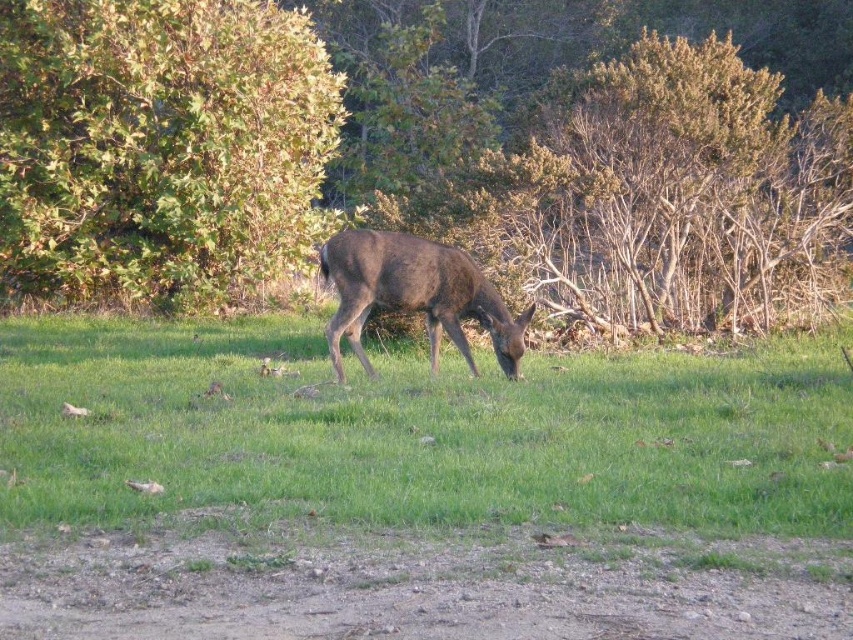
Measure the distance from green leafy tree at upper left to green leafy bush at upper left.

A distance of 3.70 feet exists between green leafy tree at upper left and green leafy bush at upper left.

Who is lower down, green leafy tree at upper left or green leafy bush at upper left?

Positioned lower is green leafy bush at upper left.

The image size is (853, 640). What are the coordinates of `green leafy tree at upper left` in the screenshot? It's located at (428, 150).

Between green grassy at center and brown matte deer at center, which one is positioned higher?

brown matte deer at center

Between green grassy at center and brown matte deer at center, which one has more height?

brown matte deer at center is taller.

Which is behind, point (467, 512) or point (437, 332)?

Point (437, 332)

The width and height of the screenshot is (853, 640). I want to click on green grassy at center, so click(419, 429).

Between green leafy tree at upper left and green grassy at center, which one is positioned higher?

Positioned higher is green leafy tree at upper left.

Can you confirm if green leafy tree at upper left is taller than green grassy at center?

Indeed, green leafy tree at upper left has a greater height compared to green grassy at center.

Between point (19, 241) and point (502, 381), which one is positioned behind?

The point (19, 241) is behind.

Where is `green leafy tree at upper left`? The image size is (853, 640). green leafy tree at upper left is located at coordinates (428, 150).